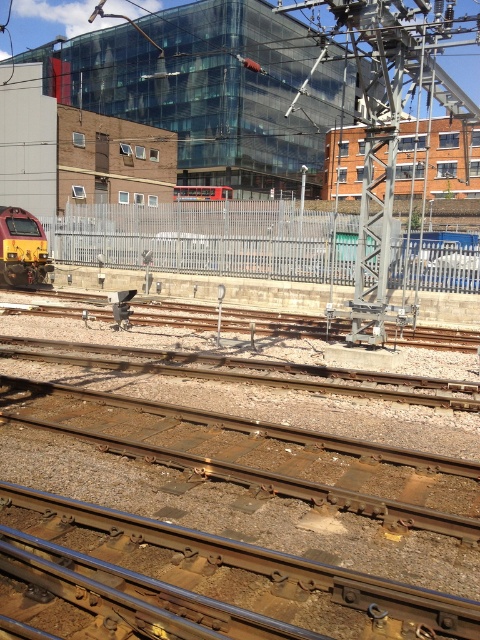
Between point (470, 605) and point (21, 218), which one is positioned in front?

Point (470, 605) is in front.

Find the location of `metal at center`. metal at center is located at coordinates (266, 563).

Which is in front, point (275, 557) or point (41, 252)?

Positioned in front is point (275, 557).

In order to click on metal at center in this screenshot , I will do [x=266, y=563].

Where is `metal at center`? The width and height of the screenshot is (480, 640). metal at center is located at coordinates (266, 563).

Is metal at center to the left of red metallic train at center from the viewer's perspective?

No, metal at center is not to the left of red metallic train at center.

Locate an element on the screen. The height and width of the screenshot is (640, 480). metal at center is located at coordinates point(266,563).

Between yellow metallic train at left and red metallic train at center, which one is positioned lower?

yellow metallic train at left

What do you see at coordinates (22, 248) in the screenshot?
I see `yellow metallic train at left` at bounding box center [22, 248].

This screenshot has width=480, height=640. What do you see at coordinates (22, 248) in the screenshot? I see `yellow metallic train at left` at bounding box center [22, 248].

In order to click on yellow metallic train at left in this screenshot , I will do `click(22, 248)`.